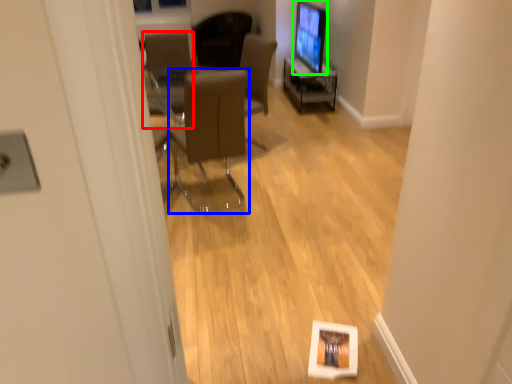
Question: Considering the real-world distances, which object is closest to chair (highlighted by a red box)? chair (highlighted by a blue box) or computer monitor (highlighted by a green box).

Choices:
 (A) chair
 (B) computer monitor

Answer: (A)